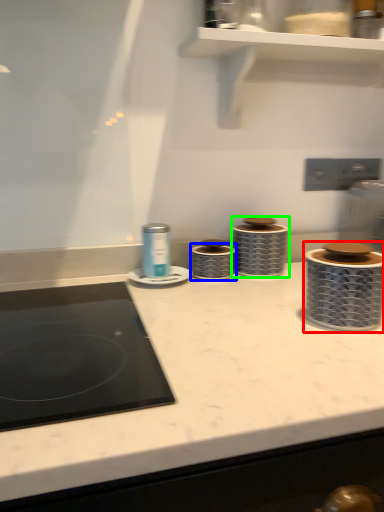
Question: Which is nearer to the appliance (highlighted by a red box)? appliance (highlighted by a blue box) or appliance (highlighted by a green box).

Choices:
 (A) appliance
 (B) appliance

Answer: (B)